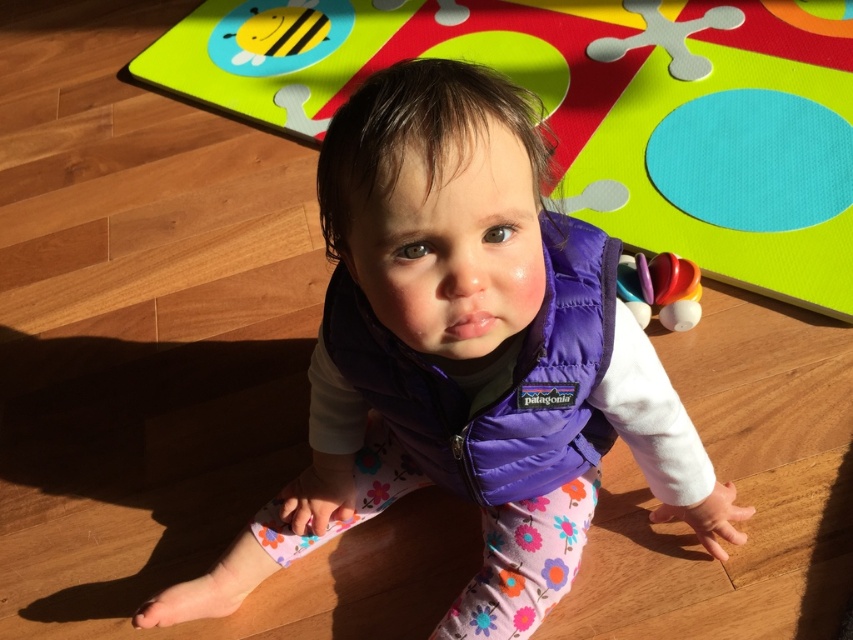
You are a parent trying to locate your child in a room. You see the purple down vest at center and the smooth plastic toy at right. Which object is closer to the floor?

The purple down vest at center is located below smooth plastic toy at right, so the purple down vest at center is closer to the floor.

Where is the purple down vest at center positioned in the image?

The purple down vest at center is positioned at coordinates point (x=465, y=356).

What are the coordinates of the purple down vest at center?

The purple down vest at center is located at point (465, 356).